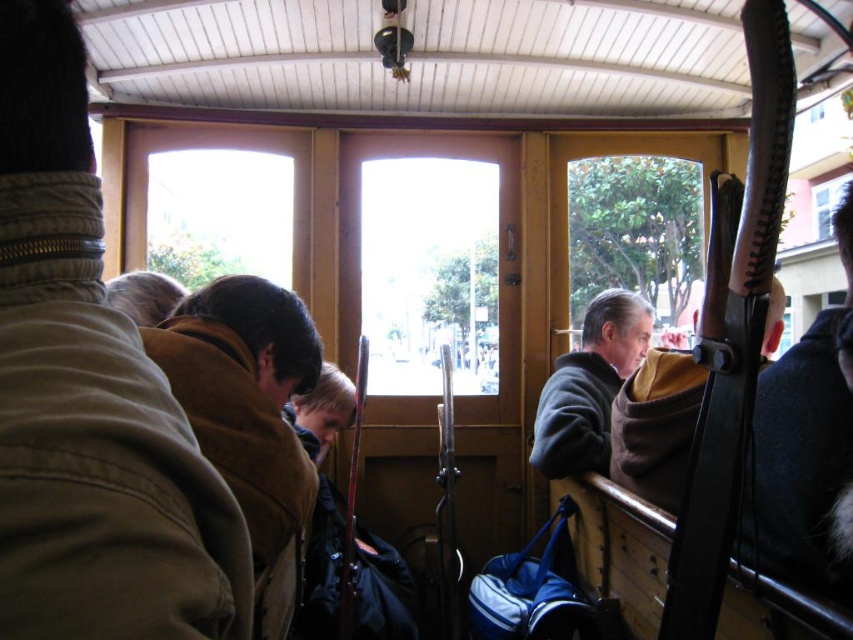
Question: Among these points, which one is farthest from the camera?

Choices:
 (A) (830, 192)
 (B) (601, 435)
 (C) (6, 516)

Answer: (A)

Question: Is brown suede jacket at left below dark gray sweater at right?

Choices:
 (A) no
 (B) yes

Answer: (A)

Question: Can you confirm if brown suede jacket at left is positioned below dark gray sweater at right?

Choices:
 (A) yes
 (B) no

Answer: (B)

Question: Can you confirm if brown suede jacket at left is positioned below dark gray sweater at right?

Choices:
 (A) yes
 (B) no

Answer: (B)

Question: Which of these objects is positioned closest to the dark gray sweater at right?

Choices:
 (A) black fur coat at right
 (B) brown suede jacket at left
 (C) brown leather jacket at upper left

Answer: (A)

Question: Which object appears closest to the camera in this image?

Choices:
 (A) black fur coat at right
 (B) dark gray sweater at right

Answer: (A)